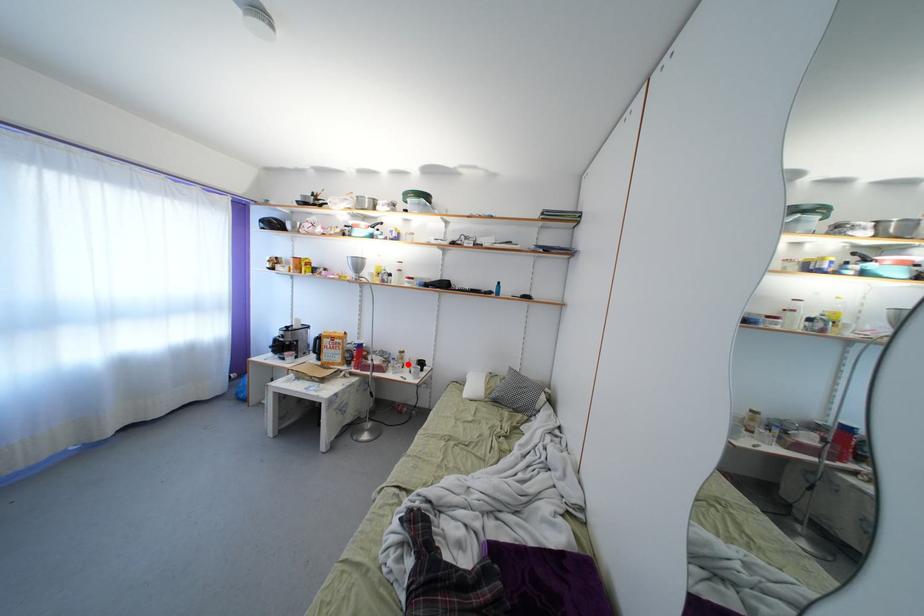
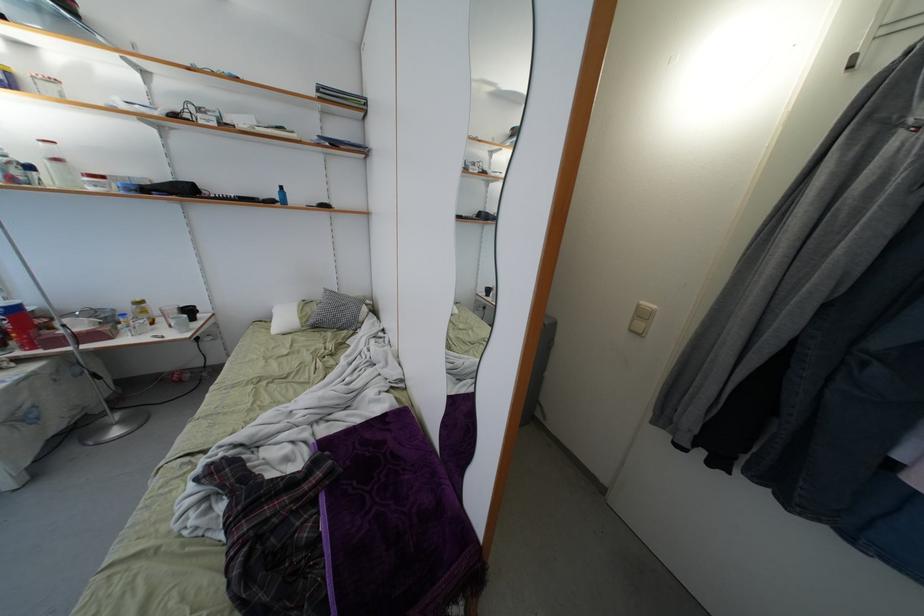
Question: A red point is marked in image1. In image2, is the corresponding 3D point closer to the camera or farther? Reply with the corresponding letter.

Choices:
 (A) The corresponding 3D point is closer.
 (B) The corresponding 3D point is farther.

Answer: (A)